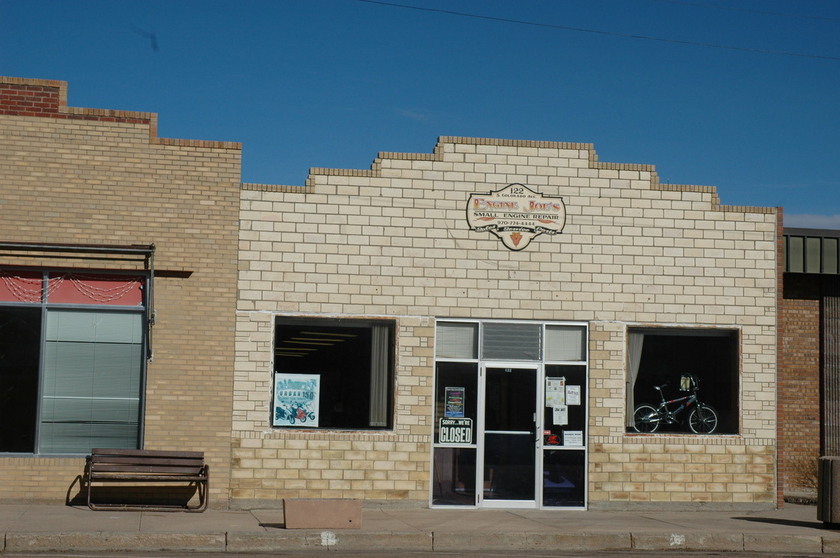
Locate an element on the screen. door is located at coordinates click(x=511, y=420).